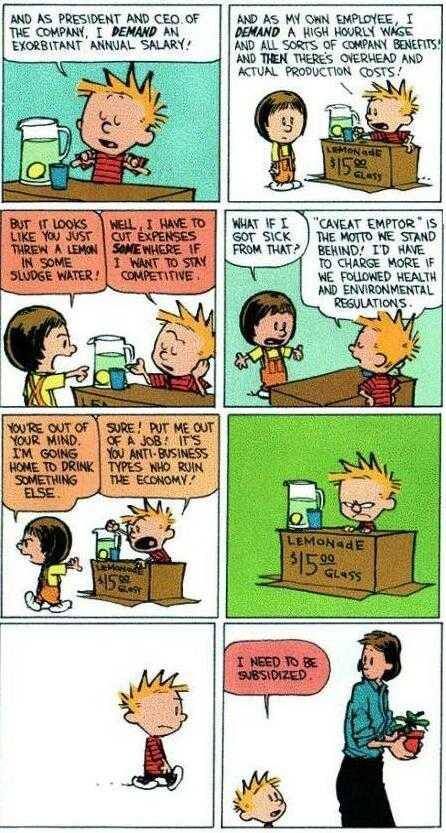
Where is `blue cup`? The image size is (446, 833). blue cup is located at coordinates (58, 178), (349, 135), (118, 377), (116, 554), (318, 519).